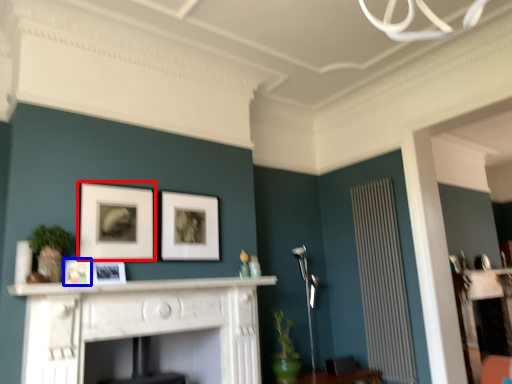
Question: Which object appears farthest to the camera in this image, picture frame (highlighted by a red box) or picture frame (highlighted by a blue box)?

Choices:
 (A) picture frame
 (B) picture frame

Answer: (A)